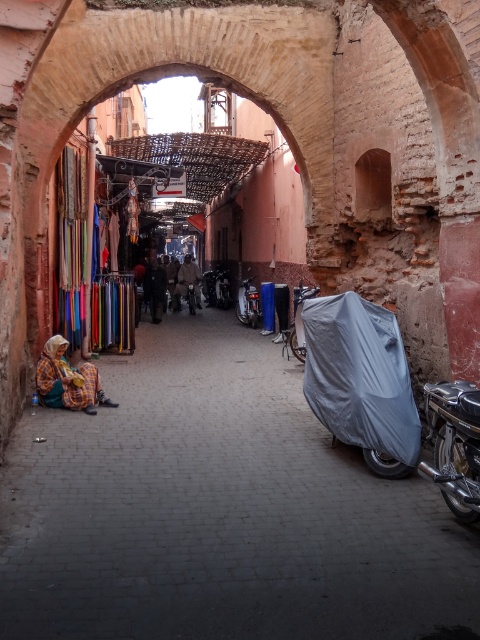
In the scene shown: You are a delivery person trying to navigate through the narrow alleyway. You see a matte gray motorcycle cover at right and a yellow plaid fabric at lower left. Which object is wider, potentially making it harder to pass by?

The matte gray motorcycle cover at right might be wider than the yellow plaid fabric at lower left, so it could be harder to pass by.

You are a delivery person trying to park your motorcycle in the alleyway. You see the matte gray motorcycle cover at right and the yellow plaid fabric at lower left. Which object is bigger and can better protect your motorcycle from the rain?

The matte gray motorcycle cover at right has a larger size compared to the yellow plaid fabric at lower left, so it can better protect your motorcycle from the rain.